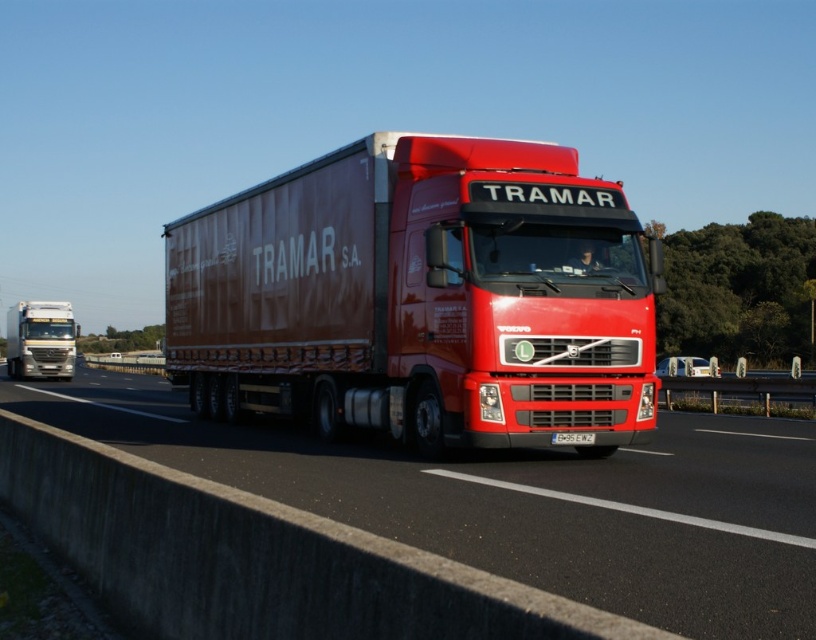
You are a traffic officer observing a red Volvo semi truck on a highway. You notice a metallic silver truck at left and a white plastic license plate at center. Which object is wider?

The metallic silver truck at left is wider than the white plastic license plate at center.

You are a driver observing the road ahead. There is a point at coordinates (40, 339). Which object in the scene does this point belong to?

The point at coordinates (40, 339) belongs to the metallic silver truck at left as stated in the Objects Description.

You are a driver who needs to know if your red matte truck at center can fit through a narrow tunnel that only allows vehicles up to the width of the white plastic license plate at center. Based on the image, can your truck pass through?

The red matte truck at center might be wider than the white plastic license plate at center, so it is uncertain if it can pass through the tunnel. Further measurements are needed.